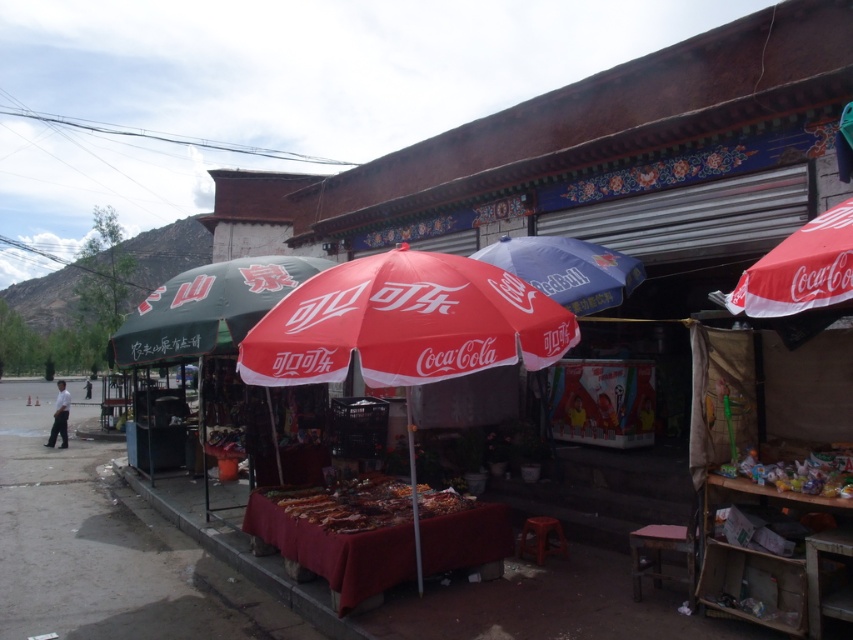
You are a delivery person carrying a large box that is 2 meters wide. You need to walk from the gray concrete pavement at lower left to the green fabric umbrella at left. Is there enough space for your box to pass through the gap between them?

The gray concrete pavement at lower left has a width less than the green fabric umbrella at left. Since the box is 2 meters wide, the gap between them may not be sufficient. However, without knowing the exact dimensions of the gap, it is uncertain if the box can pass through safely.